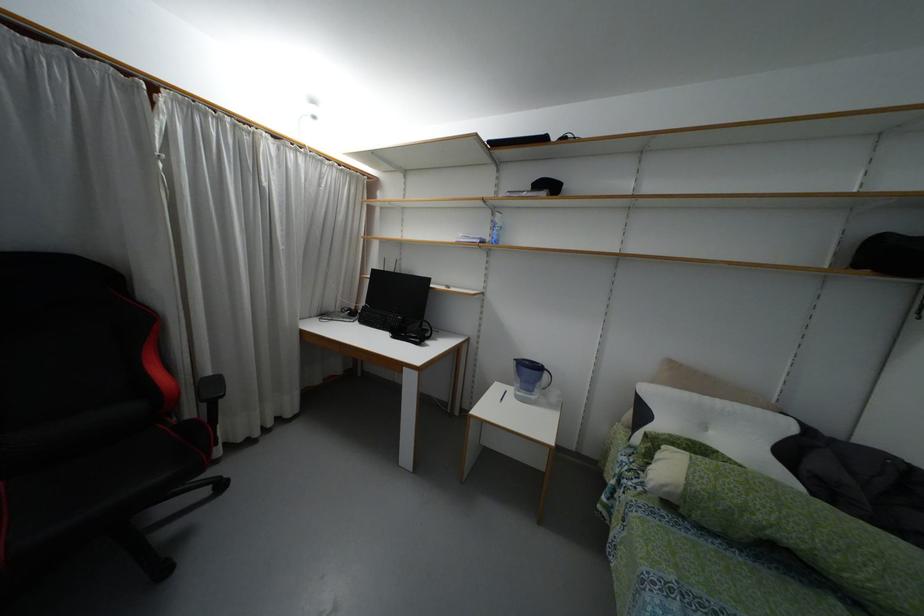
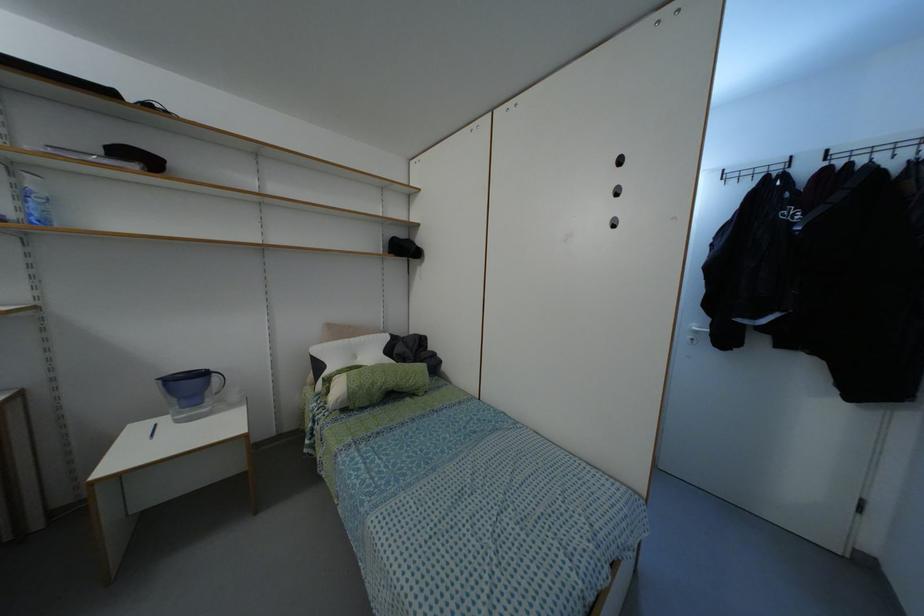
Find the pixel in the second image that matches (495,241) in the first image.

(44, 222)